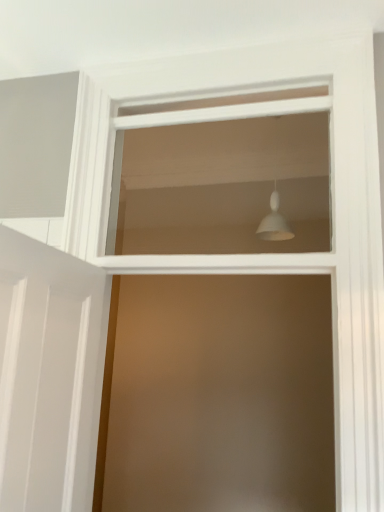
Question: Considering the relative sizes of white matte light fixture at upper center and white matte lampshade at upper center in the image provided, is white matte light fixture at upper center smaller than white matte lampshade at upper center?

Choices:
 (A) yes
 (B) no

Answer: (A)

Question: Is white matte light fixture at upper center not within white matte lampshade at upper center?

Choices:
 (A) yes
 (B) no

Answer: (A)

Question: Is white matte light fixture at upper center far away from white matte lampshade at upper center?

Choices:
 (A) yes
 (B) no

Answer: (B)

Question: Would you say white matte lampshade at upper center is part of white matte light fixture at upper center's contents?

Choices:
 (A) yes
 (B) no

Answer: (B)

Question: Considering the relative sizes of white matte light fixture at upper center and white matte lampshade at upper center in the image provided, is white matte light fixture at upper center wider than white matte lampshade at upper center?

Choices:
 (A) no
 (B) yes

Answer: (B)

Question: Is white matte light fixture at upper center taller than white matte lampshade at upper center?

Choices:
 (A) no
 (B) yes

Answer: (A)

Question: Is white matte lampshade at upper center wider than white matte light fixture at upper center?

Choices:
 (A) yes
 (B) no

Answer: (B)

Question: From the image's perspective, is white matte lampshade at upper center above white matte light fixture at upper center?

Choices:
 (A) no
 (B) yes

Answer: (A)

Question: From a real-world perspective, is white matte lampshade at upper center on top of white matte light fixture at upper center?

Choices:
 (A) no
 (B) yes

Answer: (A)

Question: Considering the relative positions of white matte lampshade at upper center and white matte light fixture at upper center in the image provided, is white matte lampshade at upper center in front of white matte light fixture at upper center?

Choices:
 (A) no
 (B) yes

Answer: (B)

Question: Can you confirm if white matte lampshade at upper center is bigger than white matte light fixture at upper center?

Choices:
 (A) yes
 (B) no

Answer: (A)

Question: Is white matte lampshade at upper center looking in the opposite direction of white matte light fixture at upper center?

Choices:
 (A) yes
 (B) no

Answer: (A)

Question: In the image, is white matte light fixture at upper center positioned in front of or behind white matte lampshade at upper center?

Choices:
 (A) behind
 (B) front

Answer: (A)